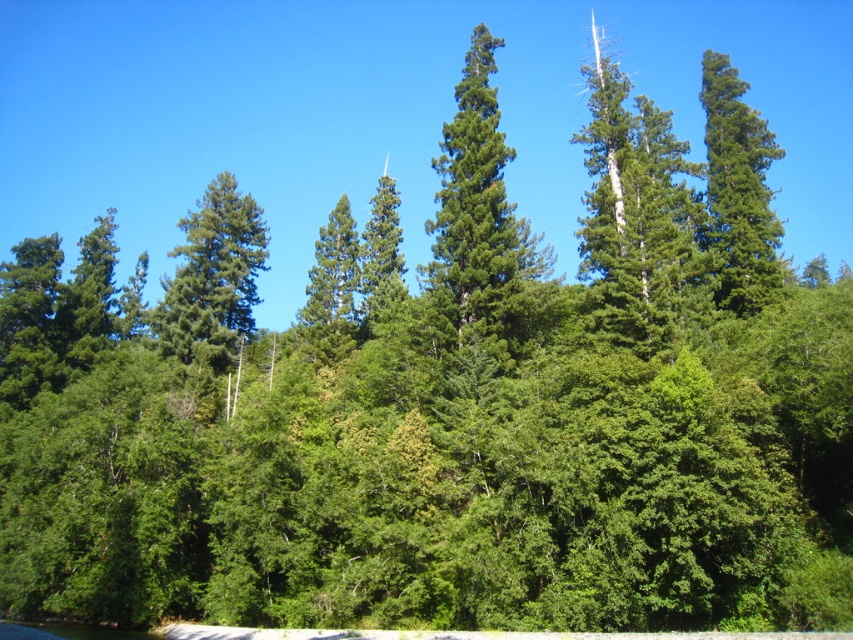
You are a bird looking for a higher perch in the dense forest. You see the green matte tree at upper right and the green matte tree at center. Which tree should you choose to get a better view?

The green matte tree at upper right is much taller than the green matte tree at center, so you should choose the green matte tree at upper right to get a better view.